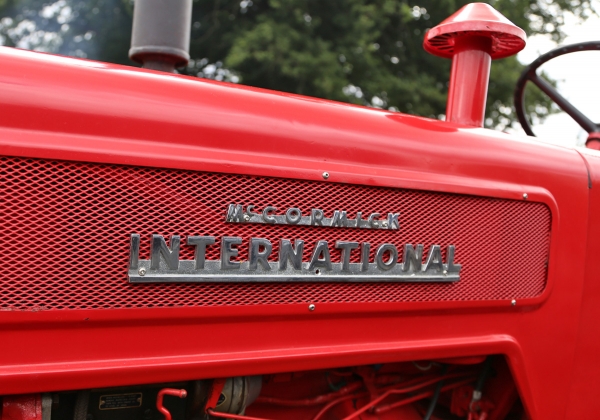
Where is `black cables`? This screenshot has width=600, height=420. black cables is located at coordinates (435, 403), (484, 375).